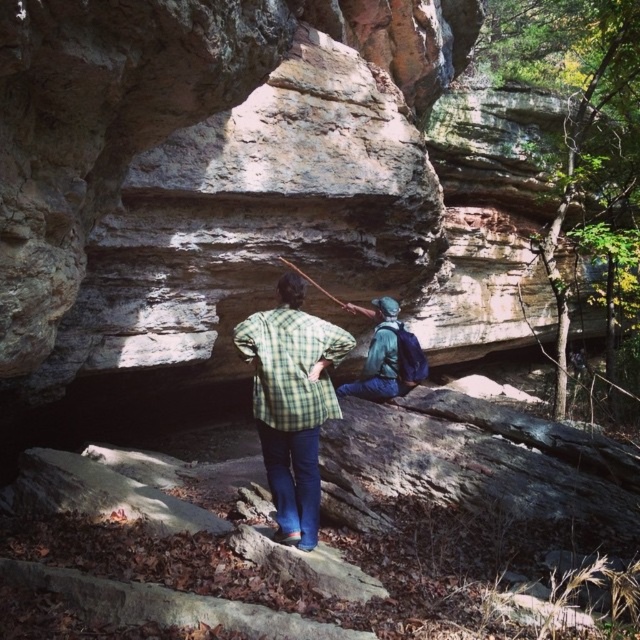
You are standing at the origin point in the scene. Which direction should you move to reach the green plaid shirt at center?

You should move towards the coordinates point (291, 403) to reach the green plaid shirt at center.